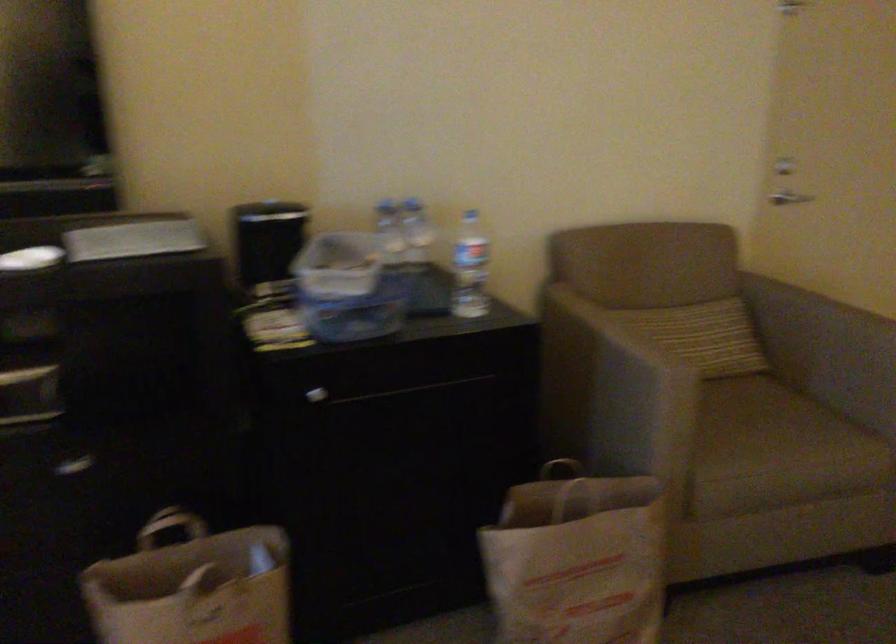
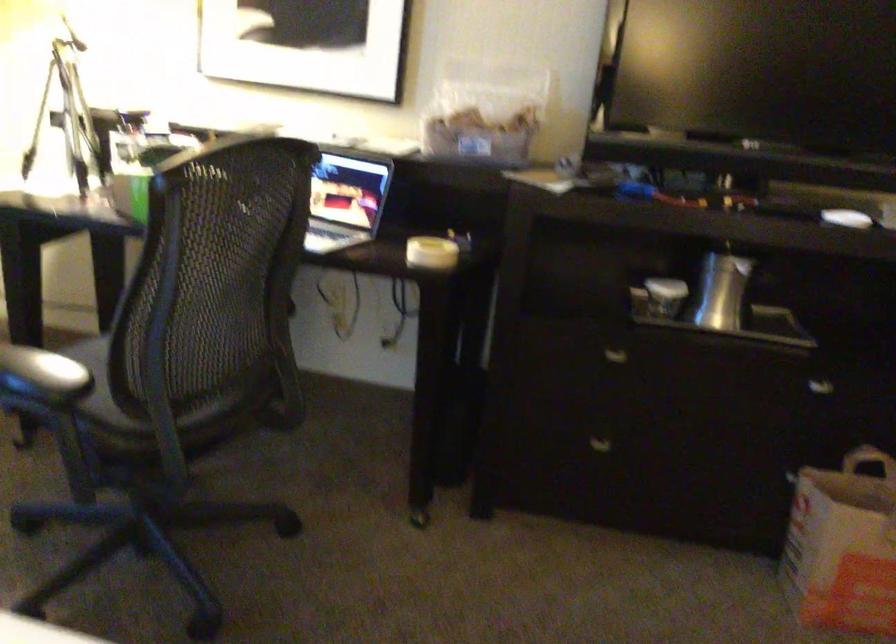
Question: How did the camera likely rotate?

Choices:
 (A) Left
 (B) Right
 (C) Up
 (D) Down

Answer: (A)